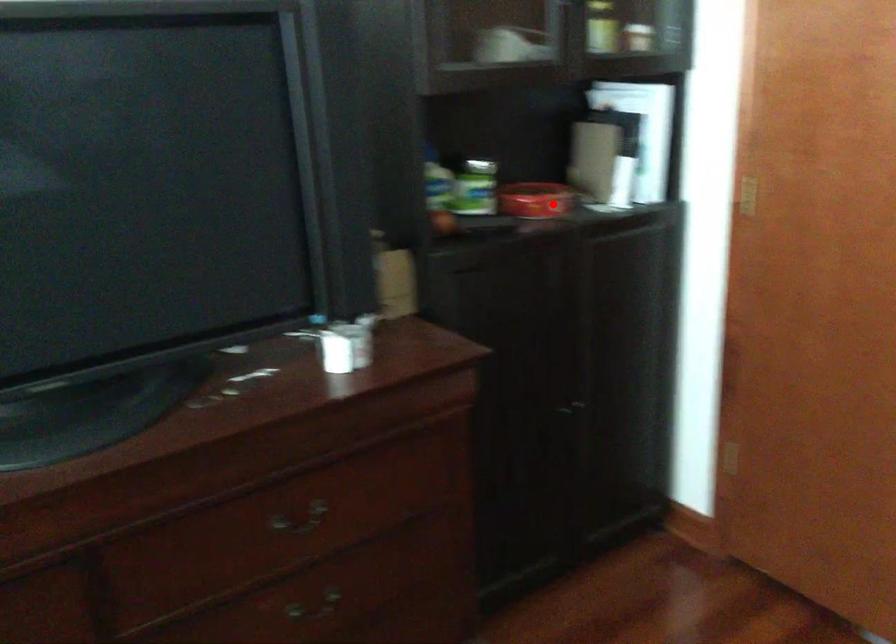
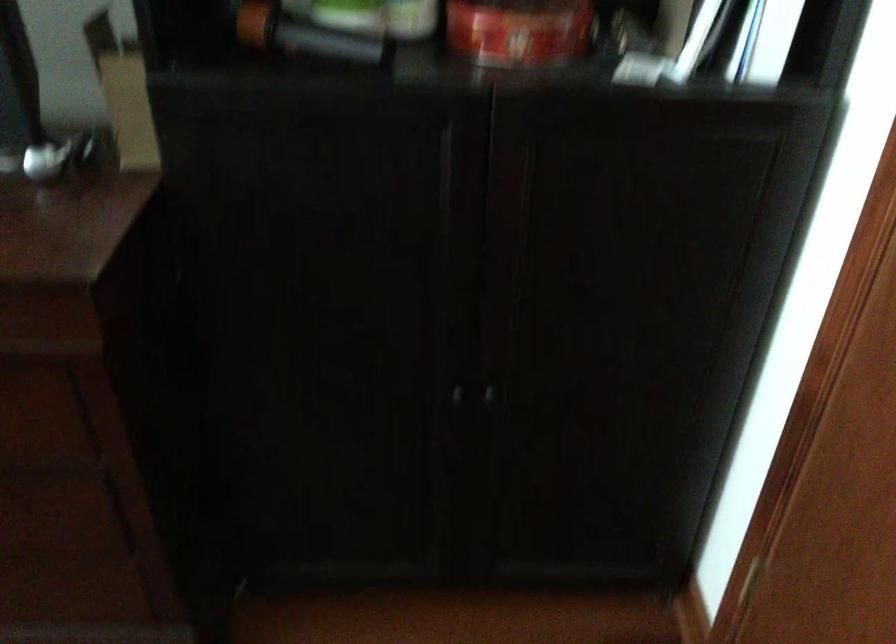
Question: I am providing you with two images of the same scene from different viewpoints. Given a red point in image1, look at the same physical point in image2. Is it:

Choices:
 (A) Closer to the viewpoint
 (B) Farther from the viewpoint

Answer: (A)